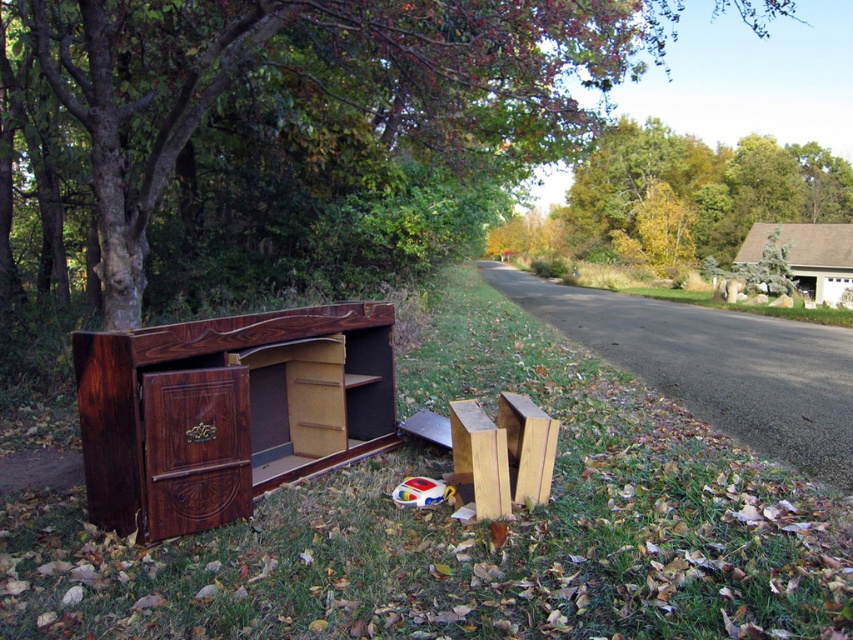
Who is positioned more to the right, brown wood tree at left or wooden drawer at center?

brown wood tree at left is more to the right.

Which is in front, point (186, 13) or point (213, 408)?

Positioned in front is point (213, 408).

Is point (350, 140) positioned before point (144, 436)?

No, it is behind (144, 436).

Locate an element on the screen. The width and height of the screenshot is (853, 640). brown wood tree at left is located at coordinates (281, 132).

Does point (375, 580) come in front of point (277, 371)?

Yes, point (375, 580) is closer to viewer.

Is brown grass at lower left shorter than dark wood cabinet at left?

Yes.

At what (x,y) coordinates should I click in order to perform the action: click on brown grass at lower left. Please return your answer as a coordinate pair (x, y). The height and width of the screenshot is (640, 853). Looking at the image, I should click on (471, 525).

I want to click on brown grass at lower left, so click(471, 525).

Does dark wood cabinet at left have a lesser height compared to wooden drawer at center?

No, dark wood cabinet at left is not shorter than wooden drawer at center.

Which is below, dark wood cabinet at left or wooden drawer at center?

wooden drawer at center is lower down.

Locate an element on the screen. The image size is (853, 640). dark wood cabinet at left is located at coordinates (225, 410).